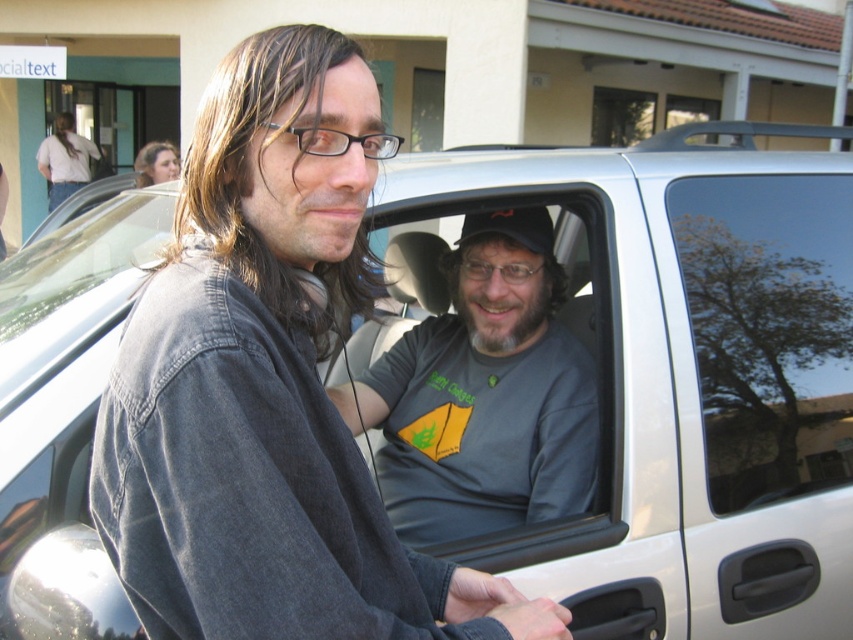
Does gray cotton t-shirt at center appear on the right side of transparent glass tree at center?

Incorrect, gray cotton t-shirt at center is not on the right side of transparent glass tree at center.

Between point (444, 403) and point (737, 330), which one is positioned in front?

Point (737, 330)

I want to click on gray cotton t-shirt at center, so click(483, 394).